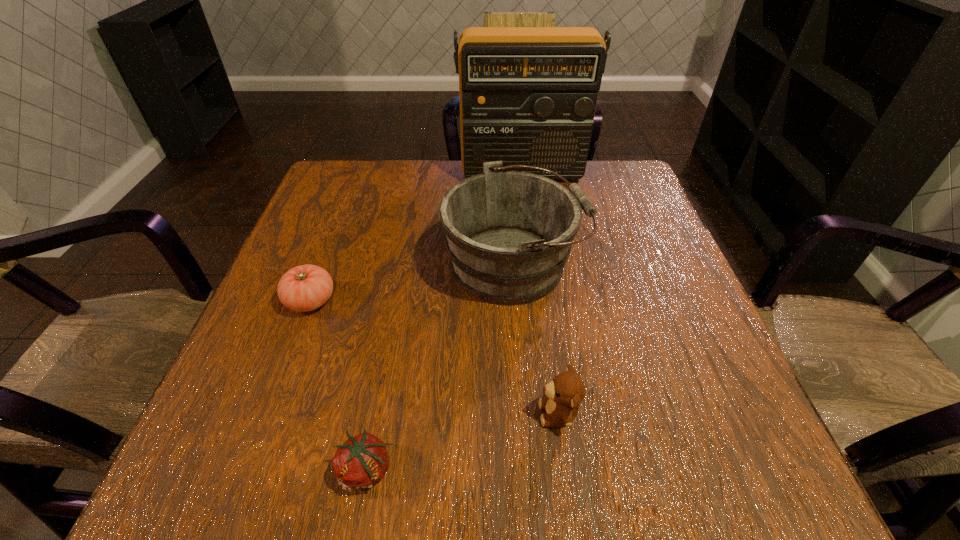
The height and width of the screenshot is (540, 960). In order to click on object that is at the far right corner in this screenshot , I will do `click(528, 95)`.

Locate an element on the screen. free region at the near edge of the desktop is located at coordinates (312, 469).

Locate an element on the screen. Image resolution: width=960 pixels, height=540 pixels. vacant region at the left edge of the desktop is located at coordinates (285, 271).

Identify the location of free spot at the right edge of the desktop. (642, 328).

I want to click on free point at the far left corner, so click(349, 191).

Identify the location of free region at the far right corner. The image size is (960, 540). (606, 170).

You are a GUI agent. You are given a task and a screenshot of the screen. Output one action in this format:
    pyautogui.click(x=<x>, y=<y>)
    Task: Click on the free spot between the tallest object and the farther tomato
    This screenshot has width=960, height=540.
    Given the screenshot: What is the action you would take?
    pyautogui.click(x=416, y=237)

At what (x,y) coordinates should I click in order to perform the action: click on vacant space that's between the taller tomato and the farthest object. Please return your answer as a coordinate pair (x, y). Looking at the image, I should click on (416, 237).

The height and width of the screenshot is (540, 960). Identify the location of blank region between the radio receiver and the shorter tomato. (444, 321).

Image resolution: width=960 pixels, height=540 pixels. Identify the location of free space between the second nearest object and the leftmost object. 434,357.